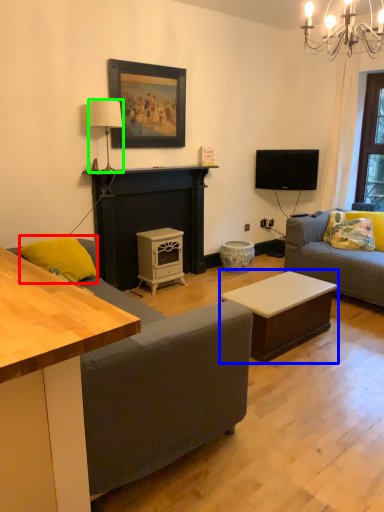
Question: Which object is the closest to the pillow (highlighted by a red box)? Choose among these: table (highlighted by a blue box) or lamp (highlighted by a green box).

Choices:
 (A) table
 (B) lamp

Answer: (B)